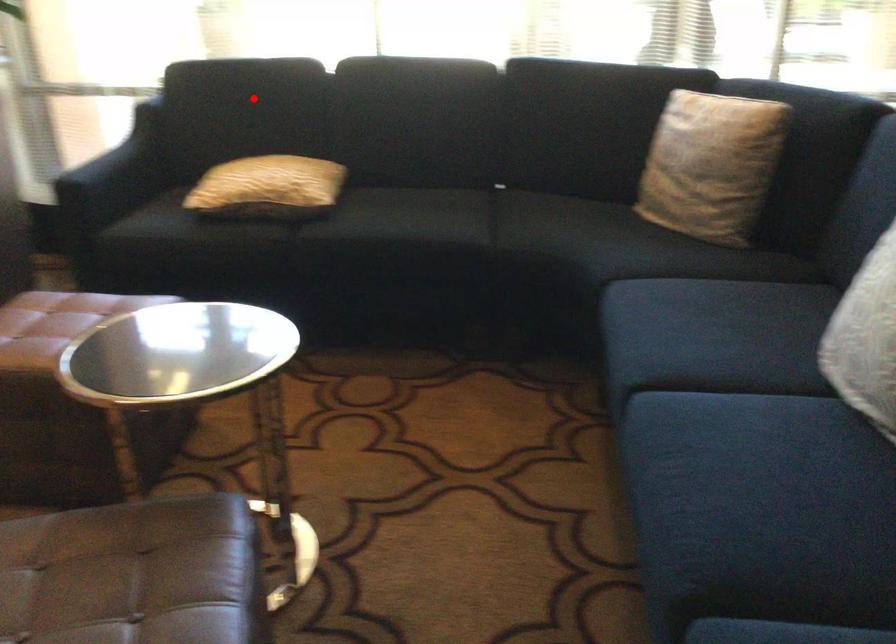
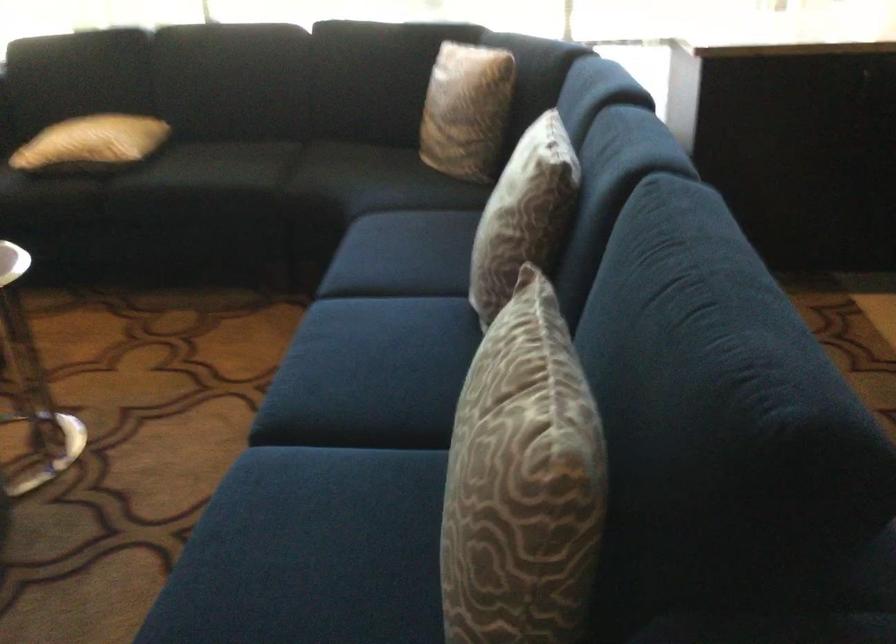
Question: A red point is marked in image1. In image2, is the corresponding 3D point closer to the camera or farther? Reply with the corresponding letter.

Choices:
 (A) The corresponding 3D point is closer.
 (B) The corresponding 3D point is farther.

Answer: (B)